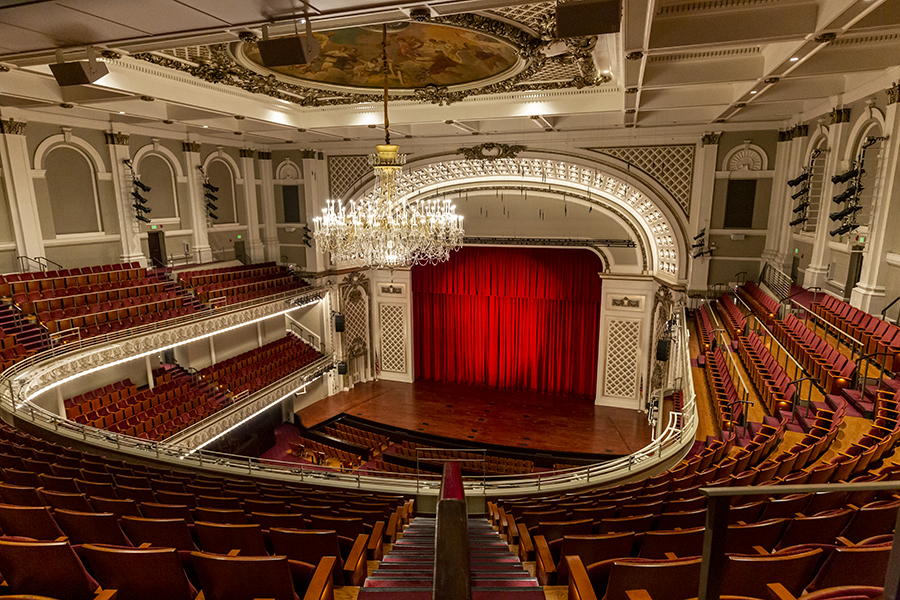
Where is `lights`? This screenshot has width=900, height=600. lights is located at coordinates (848, 177).